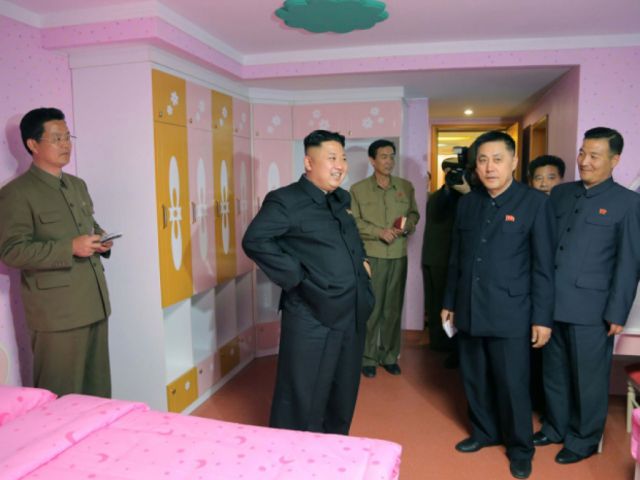
Locate an element on the screen. brown floor is located at coordinates (424, 416).